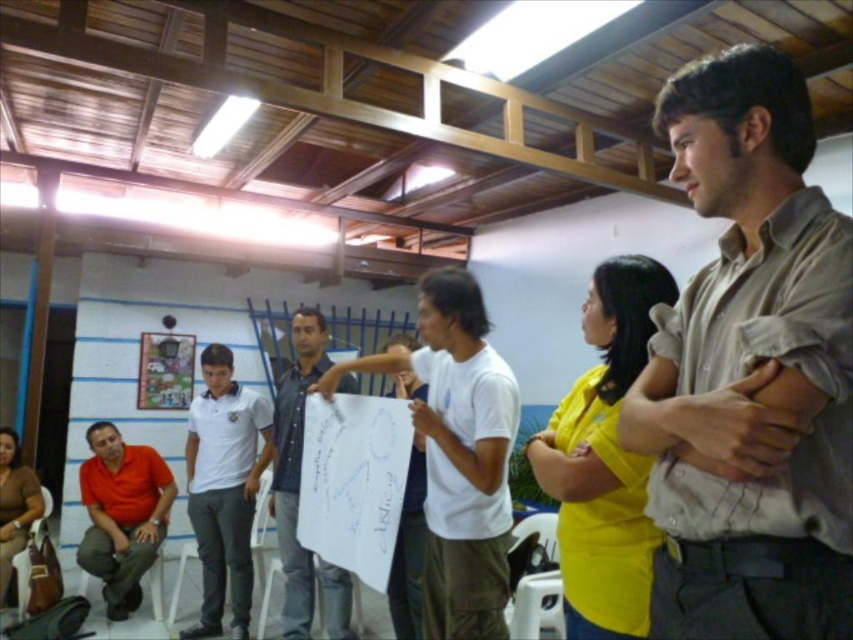
Does point (791, 548) come farther from viewer compared to point (434, 456)?

That is False.

Which is in front, point (776, 275) or point (434, 628)?

Point (776, 275)

I want to click on light brown shirt at center, so click(750, 371).

Between white matte t-shirt at center and matte orange shirt at lower left, which one appears on the left side from the viewer's perspective?

matte orange shirt at lower left is more to the left.

Can you confirm if white matte t-shirt at center is shorter than matte orange shirt at lower left?

No, white matte t-shirt at center is not shorter than matte orange shirt at lower left.

Is point (460, 538) behind point (103, 452)?

No, (460, 538) is closer to viewer.

Identify the location of white matte t-shirt at center. Image resolution: width=853 pixels, height=640 pixels. click(x=457, y=452).

Does point (611, 307) come closer to viewer compared to point (15, 513)?

That is True.

Where is `yellow matte shirt at center`? yellow matte shirt at center is located at coordinates (604, 460).

Does point (606, 424) come closer to viewer compared to point (19, 508)?

Yes, point (606, 424) is closer to viewer.

I want to click on yellow matte shirt at center, so tap(604, 460).